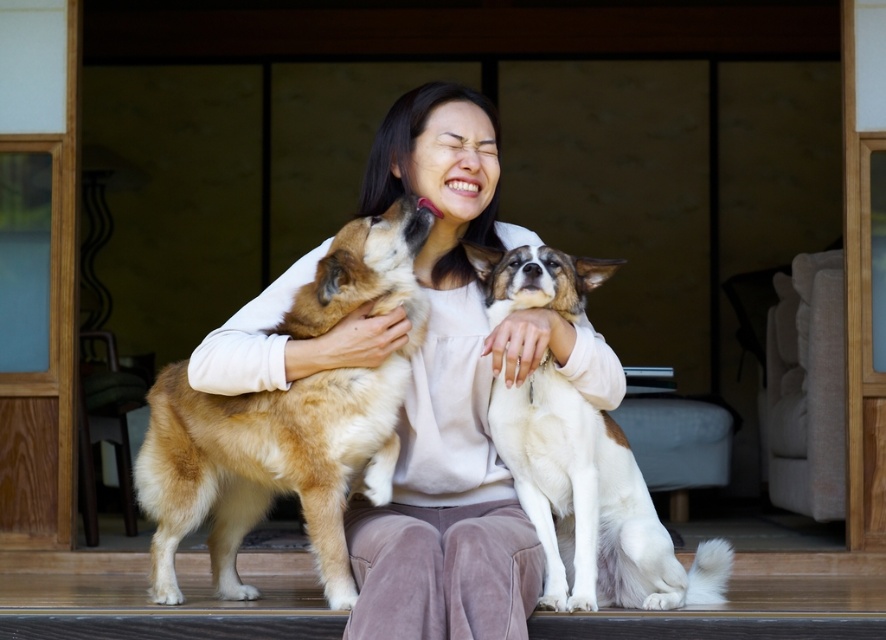
Between smooth beige sweater at center and golden fur dog at center, which one has less height?

golden fur dog at center

This screenshot has height=640, width=886. Describe the element at coordinates (457, 396) in the screenshot. I see `smooth beige sweater at center` at that location.

Is point (562, 346) behind point (241, 486)?

No, (562, 346) is closer to viewer.

What are the coordinates of `smooth beige sweater at center` in the screenshot? It's located at (x=457, y=396).

Does smooth beige sweater at center have a smaller size compared to white fur dog at center?

No.

Can you confirm if smooth beige sweater at center is positioned to the left of white fur dog at center?

Correct, you'll find smooth beige sweater at center to the left of white fur dog at center.

At what (x,y) coordinates should I click in order to perform the action: click on smooth beige sweater at center. Please return your answer as a coordinate pair (x, y). Looking at the image, I should click on (457, 396).

Between golden fur dog at center and white fur dog at center, which one appears on the left side from the viewer's perspective?

golden fur dog at center

Which is in front, point (216, 410) or point (690, 577)?

Positioned in front is point (216, 410).

Is point (335, 396) positioned before point (574, 268)?

Yes, it is in front of point (574, 268).

In order to click on golden fur dog at center in this screenshot , I will do `click(288, 422)`.